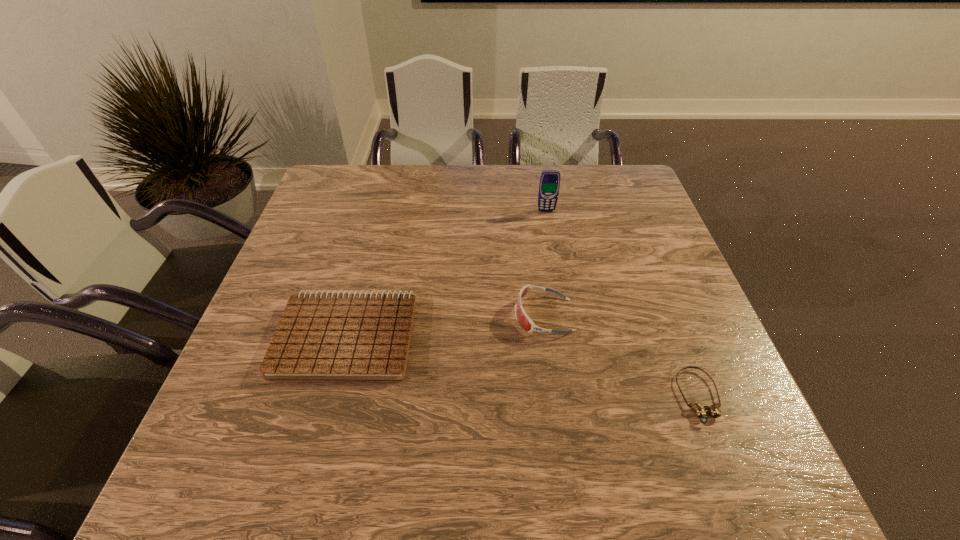
I want to click on free area in between the shortest object and the notebook, so click(522, 366).

Find the location of a particular element. This screenshot has width=960, height=540. object that ranks as the closest to the second shortest object is located at coordinates 525,322.

Locate an element on the screen. The image size is (960, 540). the second closest object relative to the left goggles is located at coordinates (321, 336).